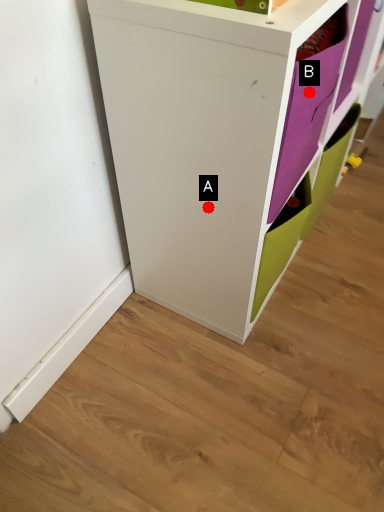
Question: Two points are circled on the image, labeled by A and B beside each circle. Which point is farther from the camera taking this photo?

Choices:
 (A) A is further
 (B) B is further

Answer: (A)